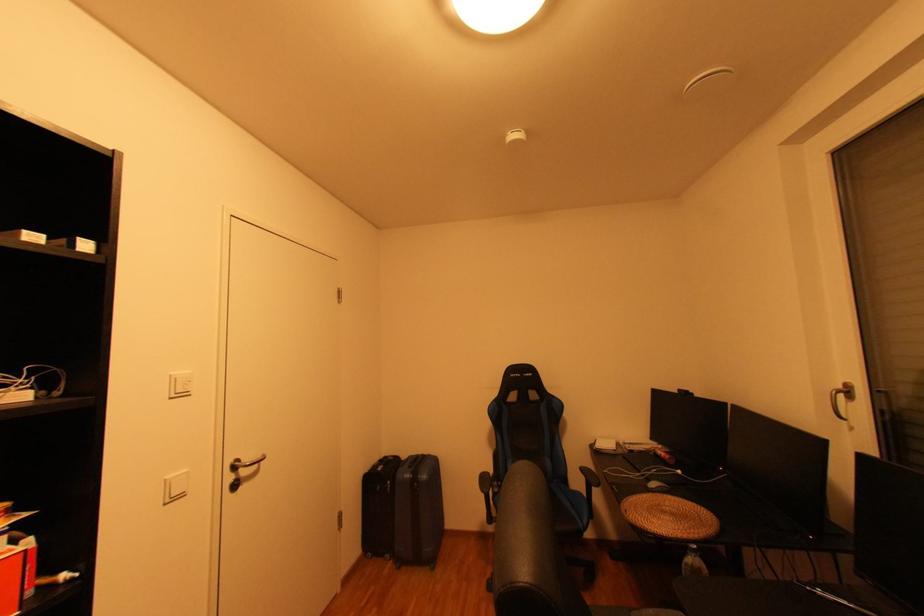
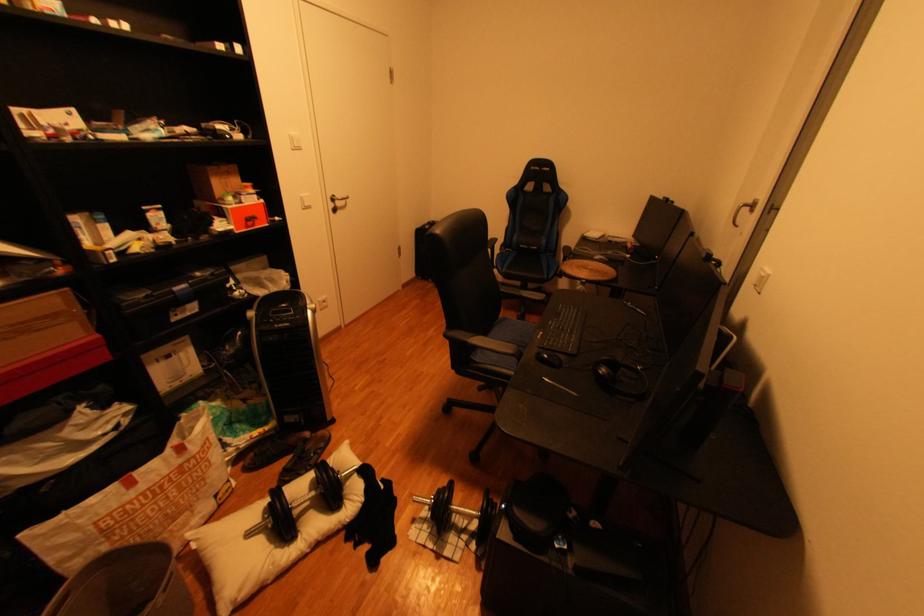
Where in the second image is the point corresponding to (247,461) from the first image?

(345, 197)